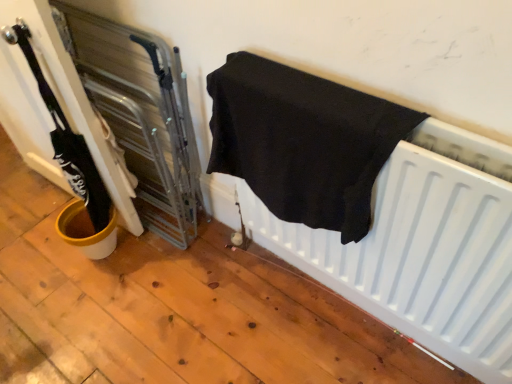
Question: Does black fabric towel at center come in front of white matte radiator at lower right?

Choices:
 (A) yes
 (B) no

Answer: (A)

Question: Is the surface of black fabric towel at center in direct contact with white matte radiator at lower right?

Choices:
 (A) no
 (B) yes

Answer: (A)

Question: From a real-world perspective, does black fabric towel at center stand above white matte radiator at lower right?

Choices:
 (A) no
 (B) yes

Answer: (B)

Question: Is black fabric towel at center taller than white matte radiator at lower right?

Choices:
 (A) no
 (B) yes

Answer: (B)

Question: Is black fabric towel at center to the right of white matte radiator at lower right from the viewer's perspective?

Choices:
 (A) no
 (B) yes

Answer: (A)

Question: Considering the relative sizes of black fabric towel at center and white matte radiator at lower right in the image provided, is black fabric towel at center smaller than white matte radiator at lower right?

Choices:
 (A) no
 (B) yes

Answer: (A)

Question: From a real-world perspective, does white matte radiator at lower right stand above black fabric towel at center?

Choices:
 (A) no
 (B) yes

Answer: (A)

Question: Is the position of white matte radiator at lower right more distant than that of black fabric towel at center?

Choices:
 (A) no
 (B) yes

Answer: (B)

Question: From the image's perspective, would you say white matte radiator at lower right is shown under black fabric towel at center?

Choices:
 (A) yes
 (B) no

Answer: (A)

Question: Is white matte radiator at lower right directly adjacent to black fabric towel at center?

Choices:
 (A) no
 (B) yes

Answer: (A)

Question: Does white matte radiator at lower right appear on the right side of black fabric towel at center?

Choices:
 (A) yes
 (B) no

Answer: (A)

Question: Is white matte radiator at lower right outside of black fabric towel at center?

Choices:
 (A) no
 (B) yes

Answer: (B)

Question: From the image's perspective, is black fabric towel at center above or below white matte radiator at lower right?

Choices:
 (A) below
 (B) above

Answer: (B)